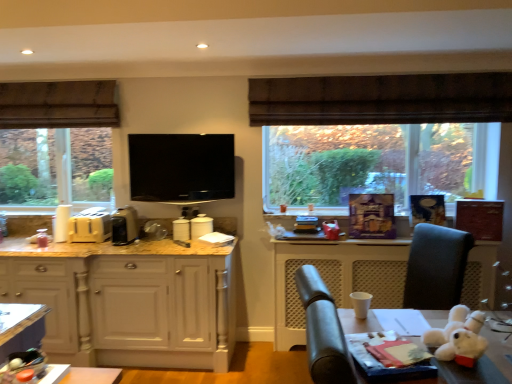
Question: Looking at their shapes, would you say matte yellow toaster at left, the fourth appliance viewed from the right, is wider or thinner than white plush toy at lower right?

Choices:
 (A) wide
 (B) thin

Answer: (B)

Question: In the image, is matte yellow toaster at left, the fourth appliance viewed from the right, positioned in front of or behind white plush toy at lower right?

Choices:
 (A) behind
 (B) front

Answer: (A)

Question: Which is farther from the metallic silver coffee machine at left, acting as the second appliance starting from the left?

Choices:
 (A) brown fabric exhaust hood at upper left
 (B) black glossy tv at center
 (C) matte wood cabinetry at left
 (D) white plush toy at lower right
 (E) white glossy canister at center, arranged as the 4th appliance when viewed from the left

Answer: (D)

Question: Which of these objects is positioned farthest from the white plush toy at lower right?

Choices:
 (A) white glossy canister at center, arranged as the 4th appliance when viewed from the left
 (B) black glossy tv at center
 (C) matte yellow toaster at left, the fourth appliance viewed from the right
 (D) white glossy toaster at center, which is counted as the second appliance, starting from the right
 (E) brown fabric exhaust hood at upper left

Answer: (E)